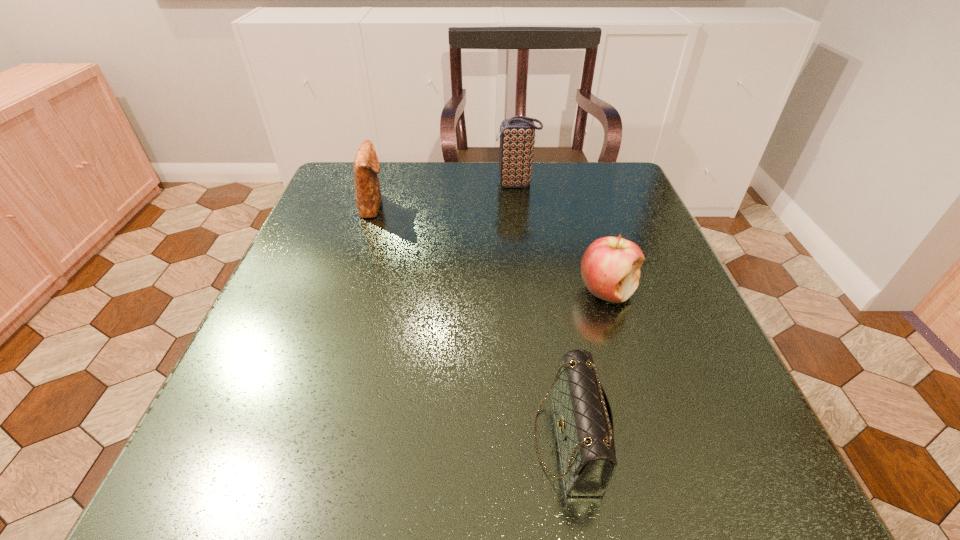
Identify the location of the tallest clutch bag. 517,134.

Identify the location of the tallest object. The image size is (960, 540). (517, 134).

This screenshot has height=540, width=960. I want to click on the leftmost object, so click(366, 165).

This screenshot has height=540, width=960. What are the coordinates of `the second farthest object` in the screenshot? It's located at (366, 165).

The height and width of the screenshot is (540, 960). I want to click on apple, so click(610, 267).

Where is `the rightmost object`? the rightmost object is located at coordinates (610, 267).

Identify the location of the nearest clutch bag. This screenshot has height=540, width=960. (584, 419).

Locate an element on the screen. the nearest object is located at coordinates (584, 419).

You are a GUI agent. You are given a task and a screenshot of the screen. Output one action in this format:
    pyautogui.click(x=<x>, y=<y>)
    Task: Click on the vacant space located with the zip open on the farthest clutch bag
    Image resolution: width=960 pixels, height=540 pixels.
    Given the screenshot: What is the action you would take?
    pyautogui.click(x=454, y=184)

Find the location of a particular element. free space located 0.360m with the zip open on the farthest clutch bag is located at coordinates (348, 184).